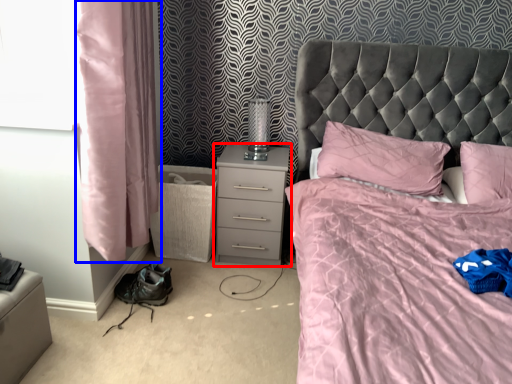
Question: Which of the following is the closest to the observer, nightstand (highlighted by a red box) or curtain (highlighted by a blue box)?

Choices:
 (A) nightstand
 (B) curtain

Answer: (B)